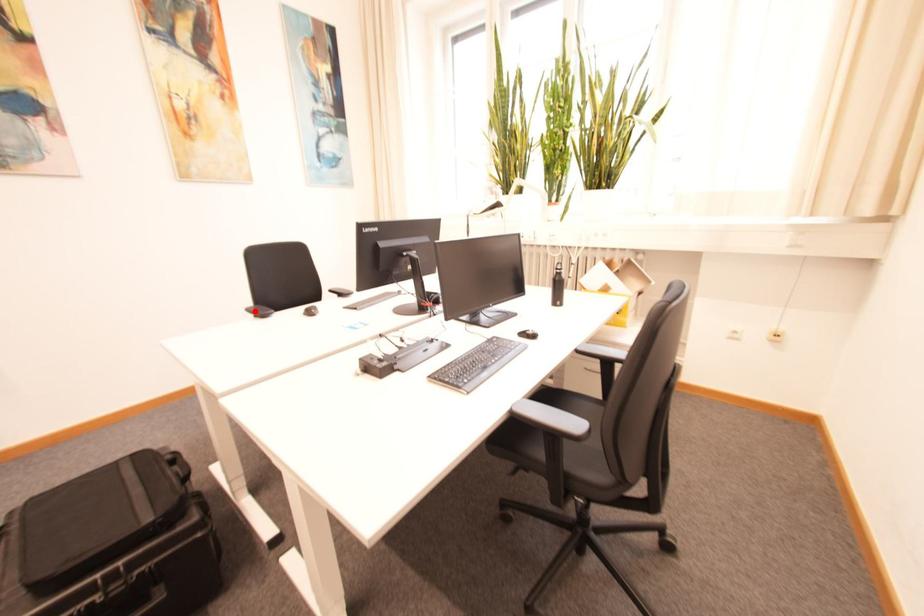
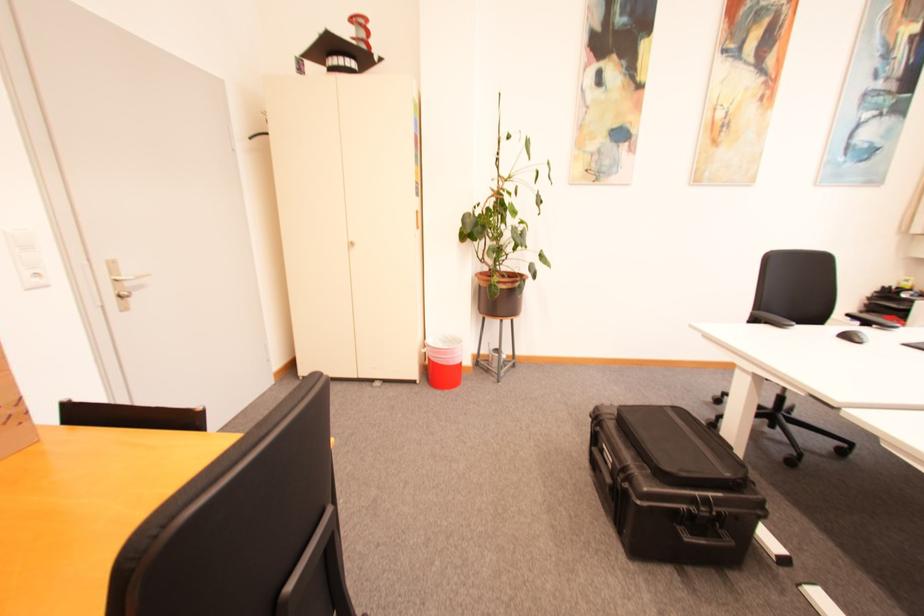
Locate, in the second image, the point that corresponds to the highlighted location in the first image.

(759, 315)